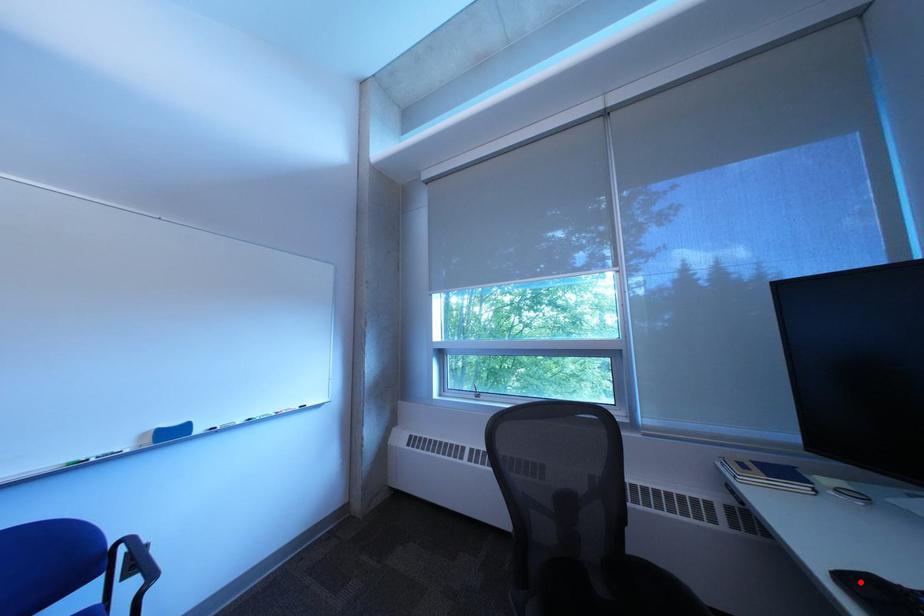
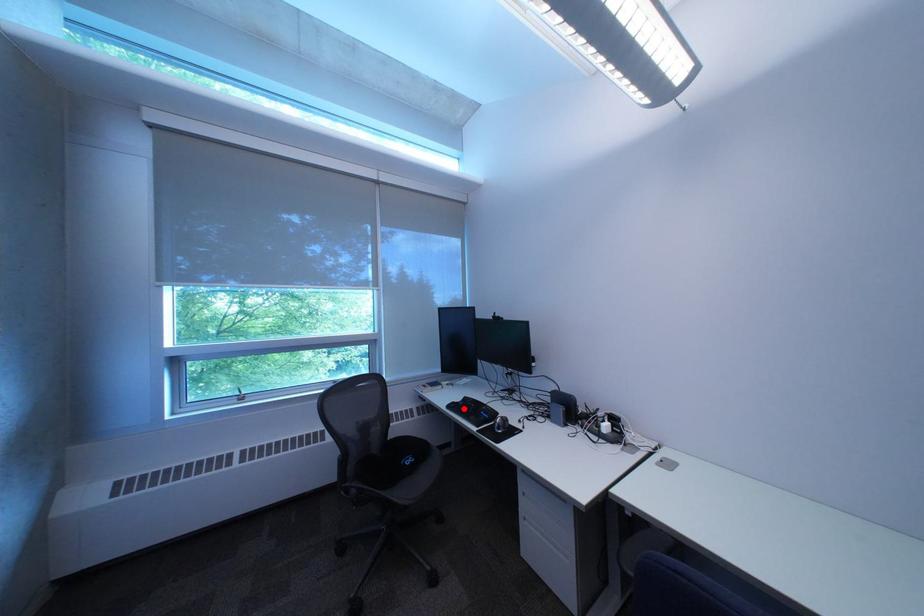
I am providing you with two images of the same scene from different viewpoints. A red point is marked on the first image and another point is marked on the second image. Are the points marked in image1 and image2 representing the same 3D position?

Yes